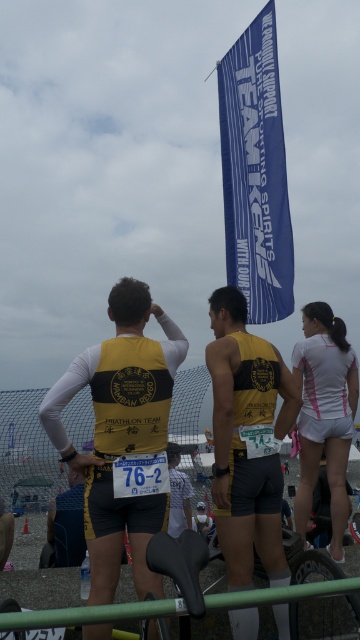
Does yellow fabric vest at center have a greater height compared to white matte shirt at center?

No, yellow fabric vest at center is not taller than white matte shirt at center.

You are a GUI agent. You are given a task and a screenshot of the screen. Output one action in this format:
    pyautogui.click(x=<x>, y=<y>)
    Task: Click on the yellow fabric vest at center
    The image size is (360, 640).
    Given the screenshot: What is the action you would take?
    pyautogui.click(x=66, y=524)

Between green rubber rail at lower center and yellow fabric vest at center, which one appears on the left side from the viewer's perspective?

From the viewer's perspective, yellow fabric vest at center appears more on the left side.

Is green rubber rail at lower center to the left of yellow fabric vest at center from the viewer's perspective?

No, green rubber rail at lower center is not to the left of yellow fabric vest at center.

Who is more forward, (29, 620) or (52, 508)?

Point (29, 620) is in front.

I want to click on green rubber rail at lower center, so click(x=88, y=614).

Which is behind, point (119, 301) or point (297, 374)?

The point (297, 374) is more distant.

Can you confirm if yellow matte vest at center is positioned above white matte shorts at right?

Yes.

Between point (119, 291) and point (344, 492), which one is positioned behind?

Point (344, 492)

This screenshot has width=360, height=640. Find the location of `yellow matte vest at center`. yellow matte vest at center is located at coordinates (119, 432).